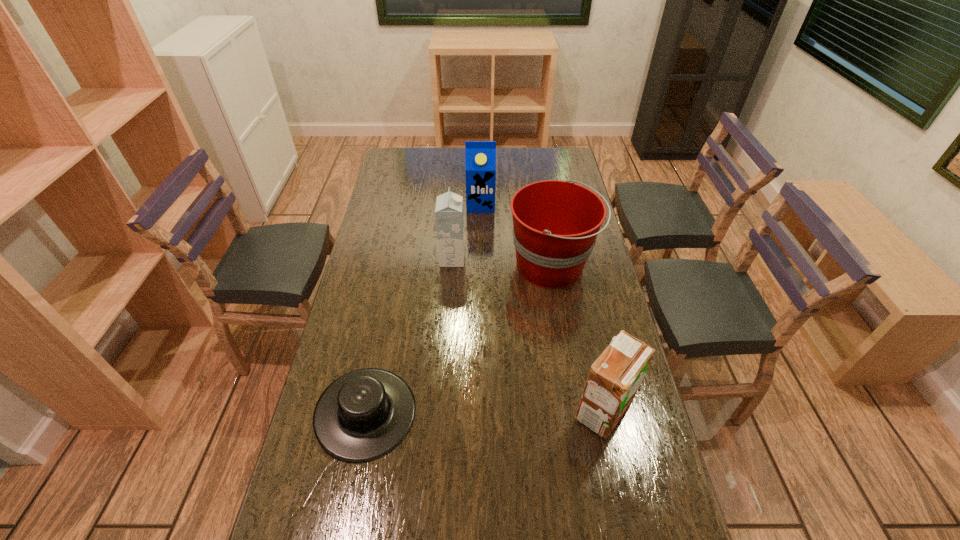
In the image, there is a desktop. Where is `vacant space at the right edge`? vacant space at the right edge is located at coordinates (544, 179).

At what (x,y) coordinates should I click in order to perform the action: click on vacant space in between the bucket and the second farthest carton. Please return your answer as a coordinate pair (x, y). Looking at the image, I should click on (502, 262).

Locate an element on the screen. The image size is (960, 540). empty space between the farthest object and the leftmost carton is located at coordinates (467, 232).

Identify the location of vacant area that lies between the leftmost object and the bucket. (459, 340).

Locate an element on the screen. The width and height of the screenshot is (960, 540). vacant area between the leftmost carton and the farthest carton is located at coordinates (467, 232).

This screenshot has width=960, height=540. I want to click on free space between the leftmost carton and the farthest object, so click(x=467, y=232).

Locate an element on the screen. free space that is in between the leftmost object and the second object from left to right is located at coordinates (409, 336).

The image size is (960, 540). Identify the location of the closest object to the shortest object. (555, 223).

Choose which object is the third nearest neighbor to the farthest object. Please provide its 2D coordinates. Your answer should be formatted as a tuple, i.e. [(x, y)], where the tuple contains the x and y coordinates of a point satisfying the conditions above.

[(364, 414)]

Select which carton appears as the second closest to the third object from left to right. Please provide its 2D coordinates. Your answer should be formatted as a tuple, i.e. [(x, y)], where the tuple contains the x and y coordinates of a point satisfying the conditions above.

[(614, 378)]